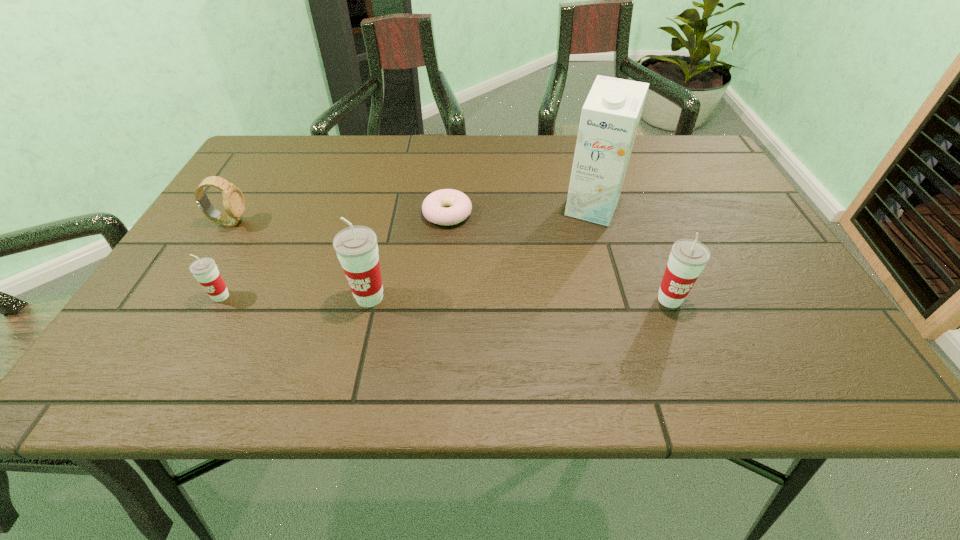
Locate an element on the screen. vacant space situated on the side of the shortest cup with the logo is located at coordinates point(201,333).

What are the coordinates of `vacant space located on the back of the second object from right to left` in the screenshot? It's located at (576, 155).

Where is `vacant space situated on the left of the third object from right to left`? vacant space situated on the left of the third object from right to left is located at coordinates 377,214.

Where is `blank space located on the face of the watch`? The width and height of the screenshot is (960, 540). blank space located on the face of the watch is located at coordinates (280, 222).

Locate an element on the screen. This screenshot has width=960, height=540. cup positioned at the left edge is located at coordinates (204, 269).

Locate an element on the screen. Image resolution: width=960 pixels, height=540 pixels. watch that is at the left edge is located at coordinates (233, 199).

Image resolution: width=960 pixels, height=540 pixels. Find the location of `vacant space at the far edge of the desktop`. vacant space at the far edge of the desktop is located at coordinates (337, 154).

Image resolution: width=960 pixels, height=540 pixels. In the image, there is a desktop. Find the location of `vacant space at the near edge`. vacant space at the near edge is located at coordinates (472, 310).

In order to click on vacant space at the left edge in this screenshot , I will do `click(256, 185)`.

Where is `free space at the far left corner of the desktop`? The width and height of the screenshot is (960, 540). free space at the far left corner of the desktop is located at coordinates (256, 162).